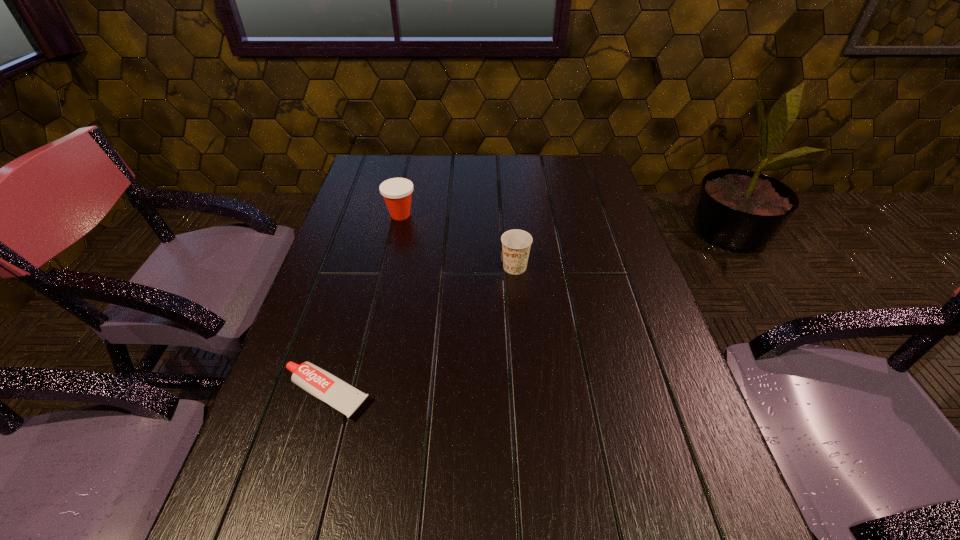
Locate an element on the screen. free space in the image that satisfies the following two spatial constraints: 1. on the back side of the shortest object; 2. on the left side of the nearer Dixie cup is located at coordinates (363, 267).